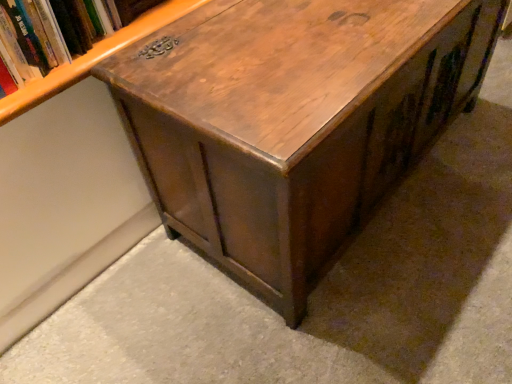
The image size is (512, 384). Identify the location of shiny brown wood table at center. [293, 121].

Image resolution: width=512 pixels, height=384 pixels. What do you see at coordinates (293, 121) in the screenshot? I see `shiny brown wood table at center` at bounding box center [293, 121].

The width and height of the screenshot is (512, 384). In order to click on wooden bookshelf at upper left in this screenshot , I will do `click(59, 31)`.

The image size is (512, 384). Describe the element at coordinates (59, 31) in the screenshot. I see `wooden bookshelf at upper left` at that location.

In order to face wooden bookshelf at upper left, should I rotate leftwards or rightwards?

You should rotate left by 25.637 degrees.

Where is `shiny brown wood table at center`? shiny brown wood table at center is located at coordinates (293, 121).

Between shiny brown wood table at center and wooden bookshelf at upper left, which one appears on the left side from the viewer's perspective?

wooden bookshelf at upper left.

Which object is closer to the camera, shiny brown wood table at center or wooden bookshelf at upper left?

shiny brown wood table at center is more forward.

Does point (374, 71) appear closer or farther from the camera than point (0, 5)?

Point (374, 71) is farther from the camera than point (0, 5).

From the image's perspective, is shiny brown wood table at center on top of wooden bookshelf at upper left?

No, from the image's perspective, shiny brown wood table at center is not over wooden bookshelf at upper left.

From a real-world perspective, is shiny brown wood table at center under wooden bookshelf at upper left?

Indeed, from a real-world perspective, shiny brown wood table at center is positioned beneath wooden bookshelf at upper left.

Considering the relative sizes of shiny brown wood table at center and wooden bookshelf at upper left in the image provided, is shiny brown wood table at center thinner than wooden bookshelf at upper left?

In fact, shiny brown wood table at center might be wider than wooden bookshelf at upper left.

Can you confirm if shiny brown wood table at center is shorter than wooden bookshelf at upper left?

No.

Considering the relative sizes of shiny brown wood table at center and wooden bookshelf at upper left in the image provided, is shiny brown wood table at center bigger than wooden bookshelf at upper left?

Yes.

From the picture: Is wooden bookshelf at upper left completely or partially inside shiny brown wood table at center?

No, wooden bookshelf at upper left is not surrounded by shiny brown wood table at center.

Is shiny brown wood table at center not near wooden bookshelf at upper left?

shiny brown wood table at center is actually quite close to wooden bookshelf at upper left.

Is shiny brown wood table at center oriented away from wooden bookshelf at upper left?

shiny brown wood table at center is not turned away from wooden bookshelf at upper left.

This screenshot has width=512, height=384. Identify the location of book that is on the left side of shiny brown wood table at center. (59, 31).

Can you confirm if wooden bookshelf at upper left is positioned to the right of shiny brown wood table at center?

No, wooden bookshelf at upper left is not to the right of shiny brown wood table at center.

Is wooden bookshelf at upper left in front of or behind shiny brown wood table at center in the image?

wooden bookshelf at upper left is behind shiny brown wood table at center.

Which point is more forward, (128, 2) or (211, 111)?

The point (211, 111) is closer to the camera.

Looking at this image, from the image's perspective, between wooden bookshelf at upper left and shiny brown wood table at center, who is located below?

shiny brown wood table at center, from the image's perspective.

In the scene shown: From a real-world perspective, is wooden bookshelf at upper left located beneath shiny brown wood table at center?

Actually, wooden bookshelf at upper left is physically above shiny brown wood table at center in the real world.

In terms of width, does wooden bookshelf at upper left look wider or thinner when compared to shiny brown wood table at center?

In the image, wooden bookshelf at upper left appears to be more narrow than shiny brown wood table at center.

Considering the relative sizes of wooden bookshelf at upper left and shiny brown wood table at center in the image provided, is wooden bookshelf at upper left taller than shiny brown wood table at center?

No, wooden bookshelf at upper left is not taller than shiny brown wood table at center.

Can you confirm if wooden bookshelf at upper left is smaller than shiny brown wood table at center?

Indeed, wooden bookshelf at upper left has a smaller size compared to shiny brown wood table at center.

Is shiny brown wood table at center inside wooden bookshelf at upper left?

No, wooden bookshelf at upper left does not contain shiny brown wood table at center.

Is wooden bookshelf at upper left positioned far away from shiny brown wood table at center?

No, wooden bookshelf at upper left is not far from shiny brown wood table at center.

Is wooden bookshelf at upper left positioned with its back to shiny brown wood table at center?

No, wooden bookshelf at upper left's orientation is not away from shiny brown wood table at center.

At what (x,y) coordinates should I click in order to perform the action: click on table below the wooden bookshelf at upper left (from the image's perspective). Please return your answer as a coordinate pair (x, y). This screenshot has width=512, height=384. Looking at the image, I should click on (293, 121).

The image size is (512, 384). I want to click on book located behind the shiny brown wood table at center, so click(x=59, y=31).

The image size is (512, 384). I want to click on book on the left of shiny brown wood table at center, so click(59, 31).